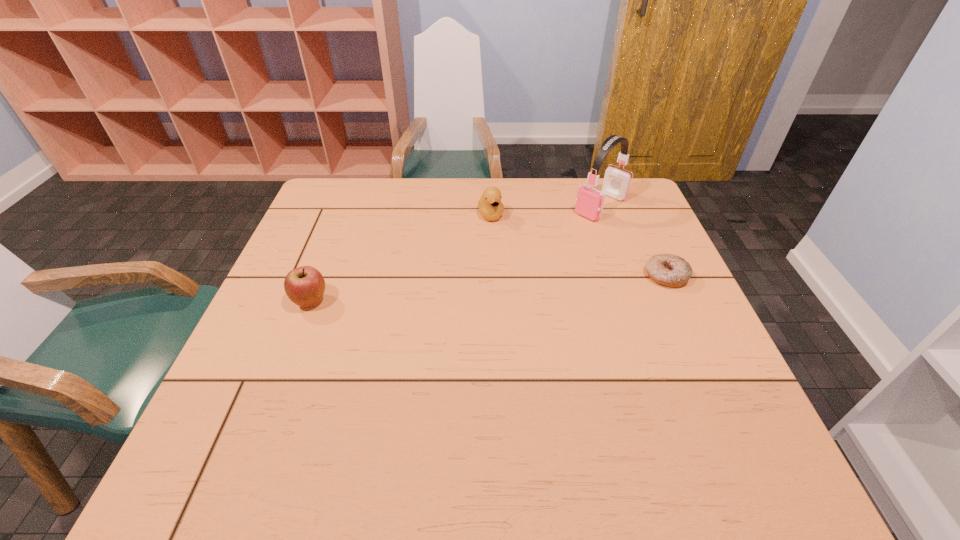
The width and height of the screenshot is (960, 540). Find the location of `free spot on the desktop that is between the apple and the doughnut and is positioned on the face of the third object from right to left`. free spot on the desktop that is between the apple and the doughnut and is positioned on the face of the third object from right to left is located at coordinates (518, 287).

Locate an element on the screen. The height and width of the screenshot is (540, 960). vacant space on the desktop that is between the apple and the doughnut and is positioned on the outer surface of the earphone is located at coordinates (492, 288).